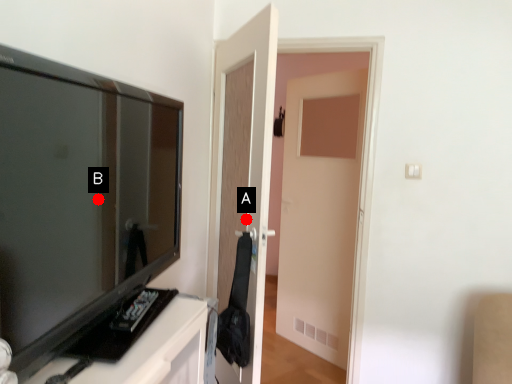
Question: Two points are circled on the image, labeled by A and B beside each circle. Which of the following is the closest to the observer?

Choices:
 (A) A is closer
 (B) B is closer

Answer: (B)